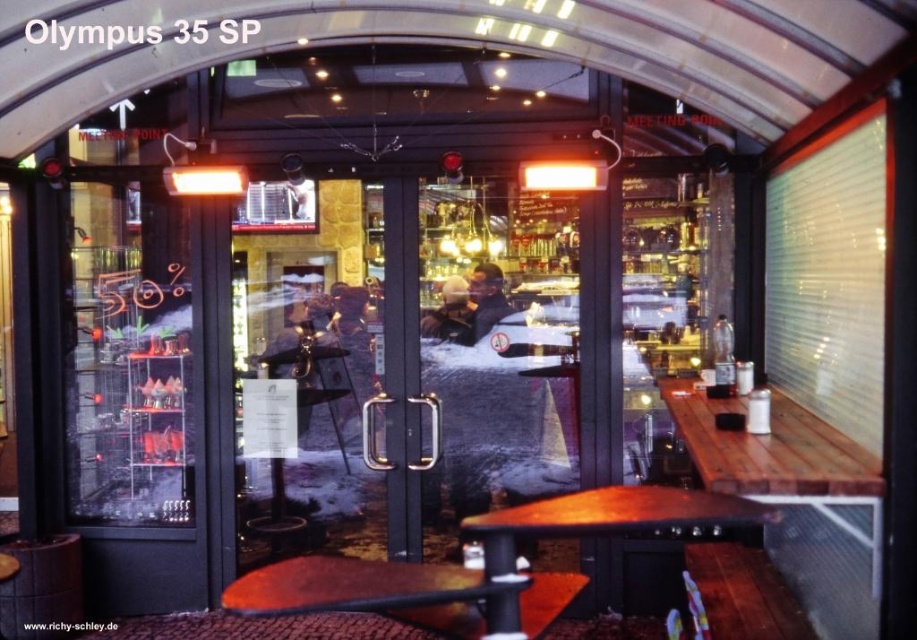
Which is more to the left, wooden table at right or wooden table at center?

wooden table at center

Is wooden table at right positioned behind wooden table at center?

Yes, it is behind wooden table at center.

What do you see at coordinates (797, 500) in the screenshot? The width and height of the screenshot is (917, 640). I see `wooden table at right` at bounding box center [797, 500].

Image resolution: width=917 pixels, height=640 pixels. I want to click on wooden table at right, so click(797, 500).

Is wooden table at right positioned at the back of brown wooden table at center?

Yes, wooden table at right is further from the viewer.

Between wooden table at right and brown wooden table at center, which one has less height?

Standing shorter between the two is brown wooden table at center.

Image resolution: width=917 pixels, height=640 pixels. Describe the element at coordinates (797, 500) in the screenshot. I see `wooden table at right` at that location.

This screenshot has height=640, width=917. I want to click on wooden table at right, so click(x=797, y=500).

Is point (532, 576) positioned in front of point (688, 522)?

No, (532, 576) is further to viewer.

Who is shorter, brown wooden table at center or wooden table at center?

brown wooden table at center is shorter.

Does point (246, 602) come in front of point (728, 497)?

Yes, point (246, 602) is closer to viewer.

Identify the location of brown wooden table at center. (398, 593).